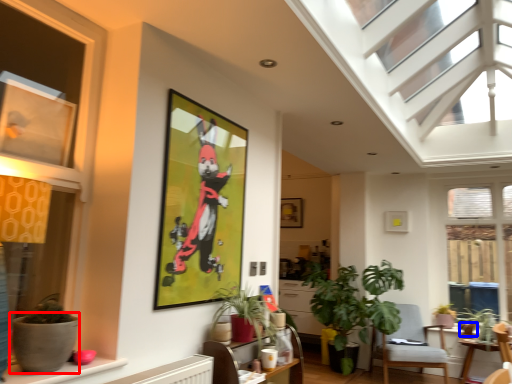
Question: Which point is closer to the camera, flowerpot (highlighted by a red box) or flowerpot (highlighted by a blue box)?

Choices:
 (A) flowerpot
 (B) flowerpot

Answer: (A)